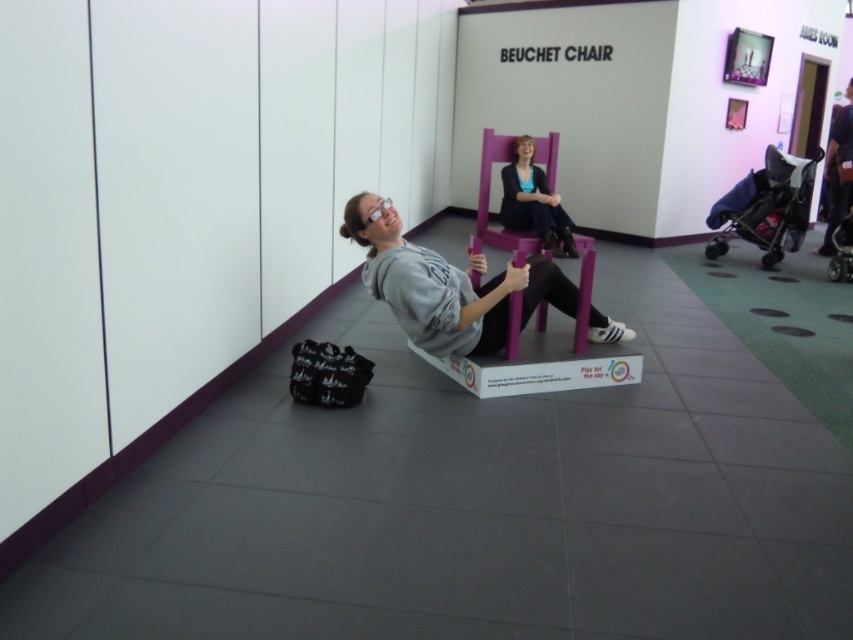
You are a visitor at an exhibition and see the blue fabric baby carriage at right and the matte purple chair at center. Which object is taller?

The blue fabric baby carriage at right is taller than the matte purple chair at center.

You are standing in front of the two purple chairs in the scene. There are two points marked in the image. Which point, point [469,260] or point [502,221], is closer to you?

Point [469,260] is closer to the camera than point [502,221].

You are a fashion designer observing the scene. You need to place a new accessory between the matte gray hoodie at center and the matte purple chair at center. Given the distance between them, can you estimate if a 20 inch accessory would fit without overlapping either item?

The distance between the matte gray hoodie at center and the matte purple chair at center is 19.57 inches. A 20 inch accessory would not fit between them without overlapping since it is slightly longer than the available space.